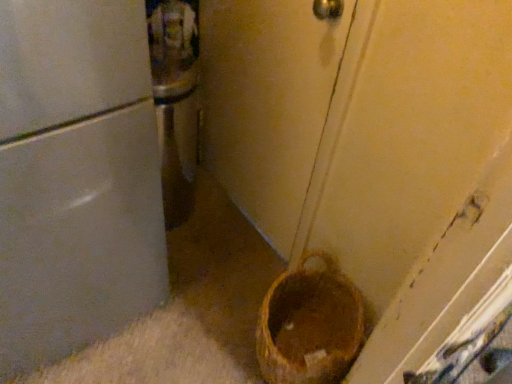
What is the approximate height of brown woven basket at lower right?

It is 8.52 inches.

I want to click on brown woven basket at lower right, so click(310, 325).

What do you see at coordinates (310, 325) in the screenshot? This screenshot has height=384, width=512. I see `brown woven basket at lower right` at bounding box center [310, 325].

Where is `matte white door at center`? The height and width of the screenshot is (384, 512). matte white door at center is located at coordinates (370, 150).

What do you see at coordinates (370, 150) in the screenshot? This screenshot has width=512, height=384. I see `matte white door at center` at bounding box center [370, 150].

The image size is (512, 384). Identify the location of brown woven basket at lower right. (310, 325).

In the image, is matte white door at center on the left side or the right side of brown woven basket at lower right?

From the image, it's evident that matte white door at center is to the left of brown woven basket at lower right.

Considering their positions, is matte white door at center located in front of or behind brown woven basket at lower right?

matte white door at center is positioned closer to the viewer than brown woven basket at lower right.

Is point (251, 114) closer or farther from the camera than point (328, 275)?

Clearly, point (251, 114) is more distant from the camera than point (328, 275).

From the image's perspective, is matte white door at center below brown woven basket at lower right?

No.

From a real-world perspective, is matte white door at center below brown woven basket at lower right?

No, from a real-world perspective, matte white door at center is not below brown woven basket at lower right.

Considering the relative sizes of matte white door at center and brown woven basket at lower right in the image provided, is matte white door at center thinner than brown woven basket at lower right?

In fact, matte white door at center might be wider than brown woven basket at lower right.

Who is shorter, matte white door at center or brown woven basket at lower right?

With less height is brown woven basket at lower right.

Does matte white door at center have a smaller size compared to brown woven basket at lower right?

Incorrect, matte white door at center is not smaller in size than brown woven basket at lower right.

Is matte white door at center not within brown woven basket at lower right?

Yes, matte white door at center is outside of brown woven basket at lower right.

Based on the photo, is matte white door at center far away from brown woven basket at lower right?

matte white door at center is near brown woven basket at lower right, not far away.

Is matte white door at center facing towards brown woven basket at lower right?

No, matte white door at center is not facing towards brown woven basket at lower right.

Where is `door that is in front of the brown woven basket at lower right`? door that is in front of the brown woven basket at lower right is located at coordinates (370, 150).

Considering the positions of objects brown woven basket at lower right and matte white door at center in the image provided, who is more to the left, brown woven basket at lower right or matte white door at center?

matte white door at center is more to the left.

From the picture: Does brown woven basket at lower right lie in front of matte white door at center?

No, the depth of brown woven basket at lower right is greater than that of matte white door at center.

Is point (349, 316) positioned before point (417, 21)?

No, (349, 316) is further to viewer.

In the scene shown: From the image's perspective, which is below, brown woven basket at lower right or matte white door at center?

brown woven basket at lower right.

Looking at this image, from a real-world perspective, is brown woven basket at lower right over matte white door at center?

Incorrect, from a real-world perspective, brown woven basket at lower right is lower than matte white door at center.

Considering the sizes of objects brown woven basket at lower right and matte white door at center in the image provided, who is thinner, brown woven basket at lower right or matte white door at center?

With smaller width is brown woven basket at lower right.

Between brown woven basket at lower right and matte white door at center, which one has less height?

brown woven basket at lower right is shorter.

Can you confirm if brown woven basket at lower right is smaller than matte white door at center?

Correct, brown woven basket at lower right occupies less space than matte white door at center.

Is brown woven basket at lower right not within matte white door at center?

brown woven basket at lower right is positioned outside matte white door at center.

Is brown woven basket at lower right directly adjacent to matte white door at center?

brown woven basket at lower right and matte white door at center are not in contact.

Is brown woven basket at lower right aimed at matte white door at center?

No, brown woven basket at lower right is not turned towards matte white door at center.

What's the angular difference between brown woven basket at lower right and matte white door at center's facing directions?

179 degrees separate the facing orientations of brown woven basket at lower right and matte white door at center.

You are a GUI agent. You are given a task and a screenshot of the screen. Output one action in this format:
    pyautogui.click(x=<x>, y=<y>)
    Task: Click on the basket container lying on the right of matte white door at center
    Image resolution: width=512 pixels, height=384 pixels.
    Given the screenshot: What is the action you would take?
    pyautogui.click(x=310, y=325)

You are a GUI agent. You are given a task and a screenshot of the screen. Output one action in this format:
    pyautogui.click(x=<x>, y=<y>)
    Task: Click on the basket container lying behind the matte white door at center
    
    Given the screenshot: What is the action you would take?
    pyautogui.click(x=310, y=325)

Identify the location of door located above the brown woven basket at lower right (from the image's perspective). (370, 150).